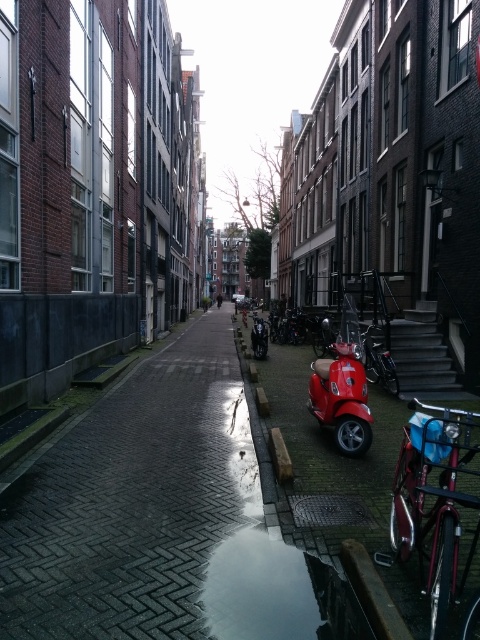
Is shiny red bicycle at lower right smaller than shiny red scooter at center?

Incorrect, shiny red bicycle at lower right is not smaller in size than shiny red scooter at center.

Is shiny red bicycle at lower right in front of shiny red scooter at center?

Yes, shiny red bicycle at lower right is in front of shiny red scooter at center.

Is point (416, 458) positioned before point (340, 348)?

Yes, point (416, 458) is in front of point (340, 348).

This screenshot has height=640, width=480. I want to click on shiny red bicycle at lower right, so click(433, 502).

Between shiny red bicycle at lower right and transparent glass puddle at lower center, which one has less height?

With less height is transparent glass puddle at lower center.

Is shiny red bicycle at lower right positioned in front of transparent glass puddle at lower center?

Yes, it is.

This screenshot has width=480, height=640. What do you see at coordinates (433, 502) in the screenshot?
I see `shiny red bicycle at lower right` at bounding box center [433, 502].

Identify the location of shiny red bicycle at lower right. (433, 502).

Is shiny black bicycle at center further to camera compared to shiny metallic bicycle at center?

No, it is not.

Who is taller, shiny black bicycle at center or shiny metallic bicycle at center?

shiny black bicycle at center

Is point (383, 353) positioned before point (321, 339)?

Yes, point (383, 353) is in front of point (321, 339).

The image size is (480, 640). What are the coordinates of `shiny black bicycle at center` in the screenshot? It's located at (379, 362).